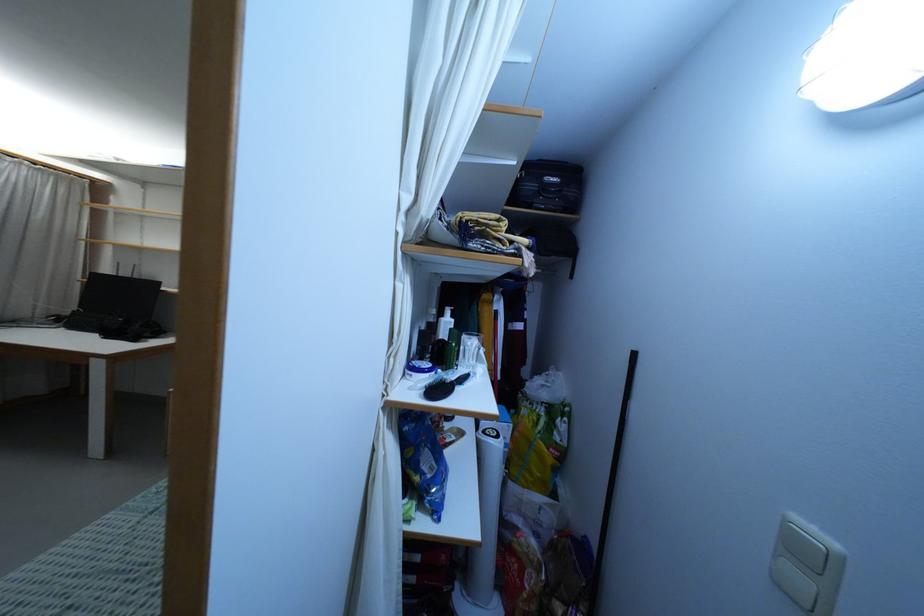
Where would you lift the black case handle? Please return your answer as a coordinate pair (x, y).

(551, 191)